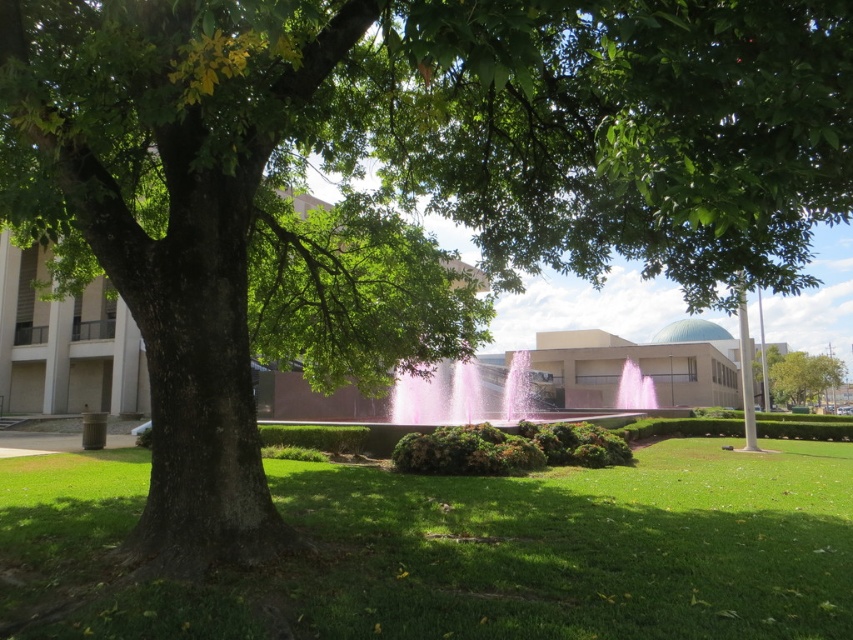
Looking at this image, you are planning to set up a picnic area in the serene outdoor scene. The picnic blanket takes up a significant amount of space. Which location would be more suitable for placing the blanket without overcrowding the area? The green grass at lower center or the green leafy tree at right?

The green grass at lower center is more suitable for placing the picnic blanket since it occupies less space than the green leafy tree at right, making it a better fit for the blanket without overcrowding.

You are standing in the park and want to take a photo of the green grass at lower center and the green leafy tree at right. Which object will appear larger in your photo?

The green grass at lower center will appear larger in the photo because it is closer to the viewer than the green leafy tree at right.